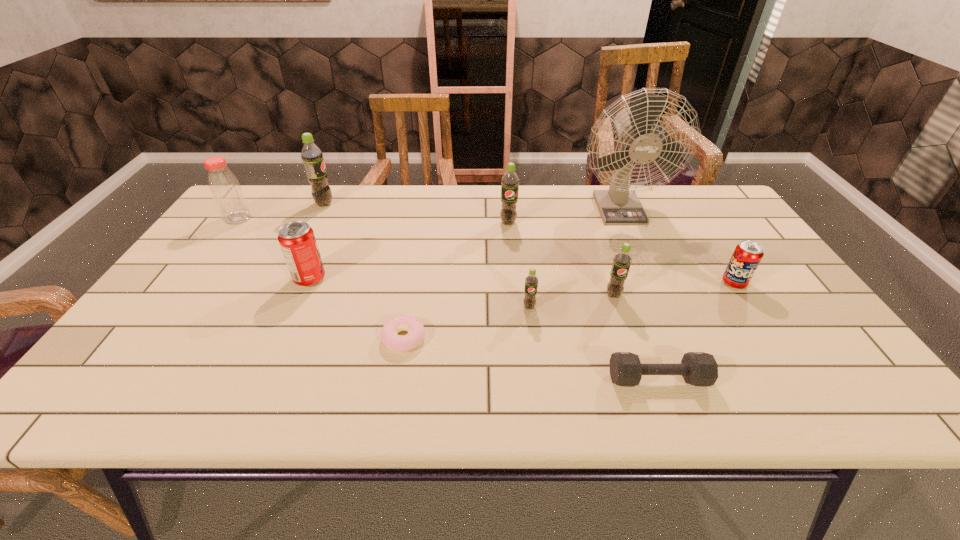
This screenshot has width=960, height=540. I want to click on free space that is in between the smallest green soda and the fourth object from left to right, so click(467, 322).

Where is `vacant space that is in between the leftmost object and the rightmost green soda`? The image size is (960, 540). vacant space that is in between the leftmost object and the rightmost green soda is located at coordinates (425, 256).

Locate which object ranks fifth in proximity to the tallest object. Please provide its 2D coordinates. Your answer should be formatted as a tuple, i.e. [(x, y)], where the tuple contains the x and y coordinates of a point satisfying the conditions above.

[(697, 368)]

Locate an element on the screen. object identified as the third closest to the bigger red soda can is located at coordinates (226, 191).

Where is `soda that stands as the fifth closest to the rightmost green soda`? This screenshot has width=960, height=540. soda that stands as the fifth closest to the rightmost green soda is located at coordinates (311, 155).

Locate which soda is the second closest to the bigger red soda can. Please provide its 2D coordinates. Your answer should be formatted as a tuple, i.e. [(x, y)], where the tuple contains the x and y coordinates of a point satisfying the conditions above.

[(510, 182)]

You are a GUI agent. You are given a task and a screenshot of the screen. Output one action in this format:
    pyautogui.click(x=<x>, y=<y>)
    Task: Click on the third closest green soda to the bigger red soda can
    The height and width of the screenshot is (540, 960).
    Given the screenshot: What is the action you would take?
    pyautogui.click(x=531, y=281)

Identify the location of the second closest green soda to the farthest soda. (531, 281).

I want to click on vacant region that satisfies the following two spatial constraints: 1. on the front label of the nearest object; 2. on the right side of the smallest green soda, so click(x=538, y=379).

The image size is (960, 540). Identify the location of blank area in the image that satisfies the following two spatial constraints: 1. on the front label of the dumbbell; 2. on the left side of the third farthest green soda. (641, 379).